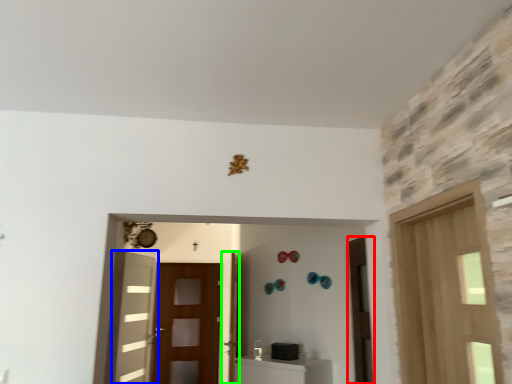
Question: Which object is the farthest from door (highlighted by a red box)? Choose among these: door (highlighted by a blue box) or door (highlighted by a green box).

Choices:
 (A) door
 (B) door

Answer: (A)